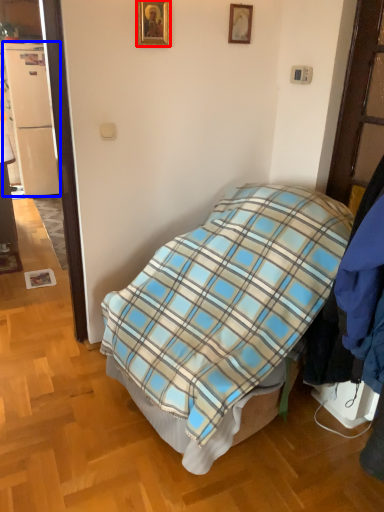
Question: Which object appears farthest to the camera in this image, picture frame (highlighted by a red box) or refrigerator (highlighted by a blue box)?

Choices:
 (A) picture frame
 (B) refrigerator

Answer: (B)